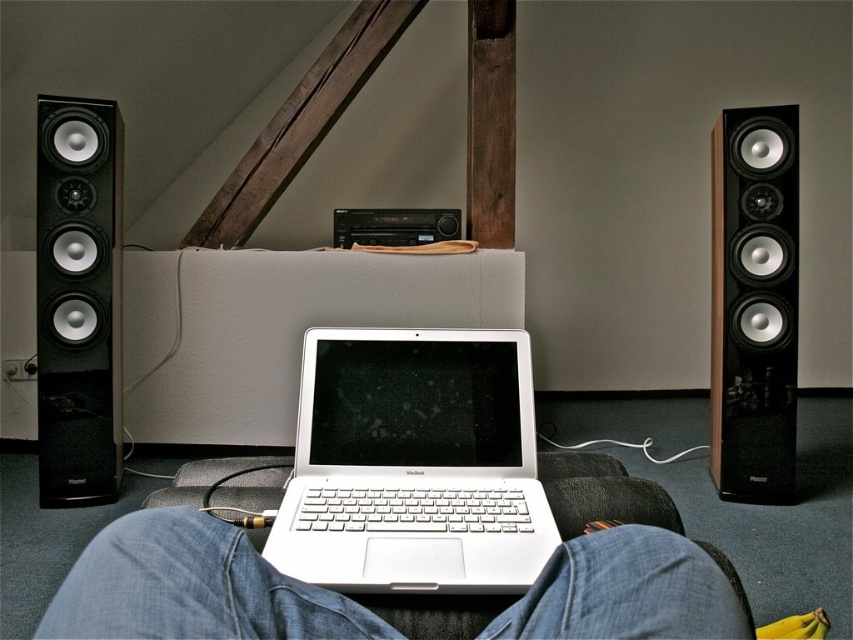
Who is positioned more to the right, white metallic laptop at center or jeans at center?

From the viewer's perspective, jeans at center appears more on the right side.

Describe the element at coordinates (415, 464) in the screenshot. I see `white metallic laptop at center` at that location.

Is point (401, 371) more distant than point (636, 536)?

Yes, it is behind point (636, 536).

Image resolution: width=853 pixels, height=640 pixels. What are the coordinates of `white metallic laptop at center` in the screenshot? It's located at (415, 464).

Which is more to the left, black glossy speaker at left or black glossy speaker at right?

black glossy speaker at left

Between point (83, 440) and point (758, 291), which one is positioned behind?

The point (83, 440) is behind.

Is point (53, 484) less distant than point (737, 264)?

That is False.

The height and width of the screenshot is (640, 853). I want to click on black glossy speaker at left, so click(78, 298).

Is point (379, 332) closer to viewer compared to point (115, 371)?

That is True.

Can you confirm if white metallic laptop at center is wider than black glossy speaker at left?

Yes, white metallic laptop at center is wider than black glossy speaker at left.

The width and height of the screenshot is (853, 640). I want to click on white metallic laptop at center, so click(x=415, y=464).

This screenshot has width=853, height=640. What are the coordinates of `white metallic laptop at center` in the screenshot? It's located at (415, 464).